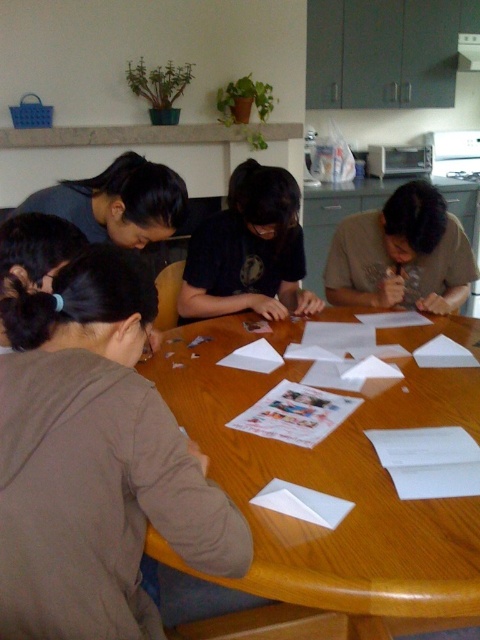
Measure the distance between point (240,385) and camera.

Point (240,385) is 5.02 feet from camera.

Does wooden table at center appear on the left side of black matte shirt at center?

In fact, wooden table at center is to the right of black matte shirt at center.

The width and height of the screenshot is (480, 640). Describe the element at coordinates (332, 486) in the screenshot. I see `wooden table at center` at that location.

Locate an element on the screen. wooden table at center is located at coordinates (332, 486).

Can you confirm if brown fabric shirt at lower left is positioned above white paper at center?

Yes.

Which is more to the right, brown fabric shirt at lower left or white paper at center?

Positioned to the right is white paper at center.

Identify the location of brown fabric shirt at lower left. The height and width of the screenshot is (640, 480). (94, 456).

Image resolution: width=480 pixels, height=640 pixels. What are the coordinates of `brown fabric shirt at lower left` in the screenshot? It's located at [x=94, y=456].

Can you confirm if wooden table at center is thinner than white paper at center?

No.

Who is positioned more to the left, wooden table at center or white paper at center?

Positioned to the left is white paper at center.

Who is more distant from viewer, (149, 544) or (333, 524)?

The point (333, 524) is more distant.

Where is `wooden table at center`? This screenshot has height=640, width=480. wooden table at center is located at coordinates (332, 486).